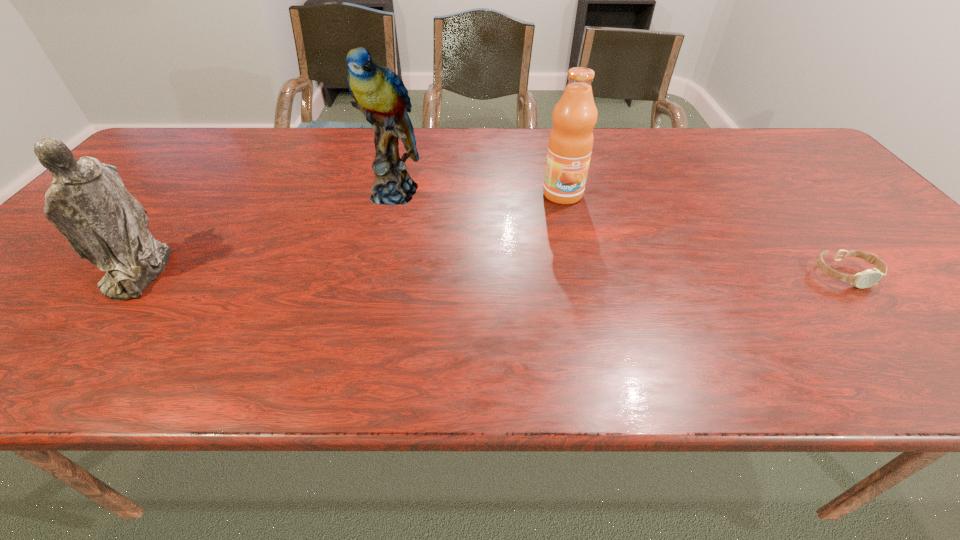
Identify the location of figurine. (87, 202).

At what (x,y) coordinates should I click in order to perform the action: click on the rightmost object. Please return your answer as a coordinate pair (x, y). This screenshot has width=960, height=540. Looking at the image, I should click on (870, 277).

Find the location of a particular element. the shortest object is located at coordinates (870, 277).

You are a GUI agent. You are given a task and a screenshot of the screen. Output one action in this format:
    pyautogui.click(x=<x>, y=<y>)
    Task: Click on the parrot
    The height and width of the screenshot is (540, 960).
    Given the screenshot: What is the action you would take?
    pyautogui.click(x=379, y=93)

Where is `the tallest object`? This screenshot has height=540, width=960. the tallest object is located at coordinates (379, 93).

At what (x,y) coordinates should I click in order to perform the action: click on the second object from right to left. Please return your answer as a coordinate pair (x, y). The image size is (960, 540). Looking at the image, I should click on (574, 117).

Identify the location of vacant space located on the front-facing side of the figurine. This screenshot has height=540, width=960. (84, 271).

Find the location of a particular element. The width and height of the screenshot is (960, 540). free space located on the front-facing side of the figurine is located at coordinates (30, 271).

At what (x,y) coordinates should I click in order to perform the action: click on free space located on the front-facing side of the figurine. Please return your answer as a coordinate pair (x, y). Looking at the image, I should click on (43, 271).

Where is `vacant space located on the face of the rightmost object`? This screenshot has width=960, height=540. vacant space located on the face of the rightmost object is located at coordinates click(881, 319).